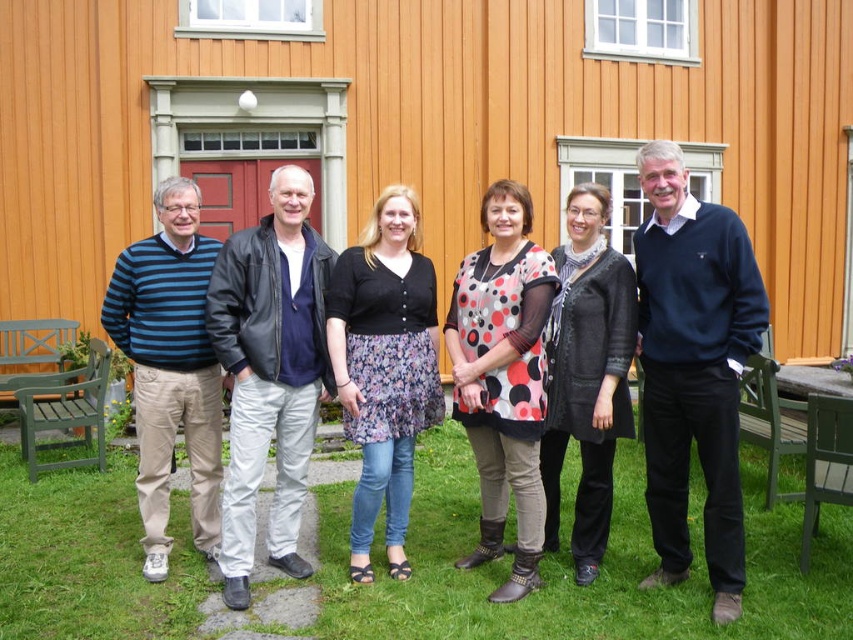
Is matte black sweater at center below black textured cardigan at center?

Incorrect, matte black sweater at center is not positioned below black textured cardigan at center.

Can you confirm if matte black sweater at center is taller than black textured cardigan at center?

Yes, matte black sweater at center is taller than black textured cardigan at center.

Between point (537, 502) and point (579, 355), which one is positioned in front?

Positioned in front is point (537, 502).

Locate an element on the screen. matte black sweater at center is located at coordinates (660, 358).

Between dark blue sweater at center and polka dot fabric dress at center, which one is positioned lower?

polka dot fabric dress at center is below.

Who is higher up, dark blue sweater at center or polka dot fabric dress at center?

dark blue sweater at center is above.

Who is more distant from viewer, [680,304] or [488,422]?

Point [488,422]

The image size is (853, 640). Find the location of `dark blue sweater at center`. dark blue sweater at center is located at coordinates (693, 369).

Based on the photo, which is below, dark blue sweater at center or black textured cardigan at center?

Positioned lower is black textured cardigan at center.

Is dark blue sweater at center shorter than black textured cardigan at center?

Incorrect, dark blue sweater at center's height does not fall short of black textured cardigan at center's.

The image size is (853, 640). Describe the element at coordinates (693, 369) in the screenshot. I see `dark blue sweater at center` at that location.

Find the location of a particular element. dark blue sweater at center is located at coordinates (693, 369).